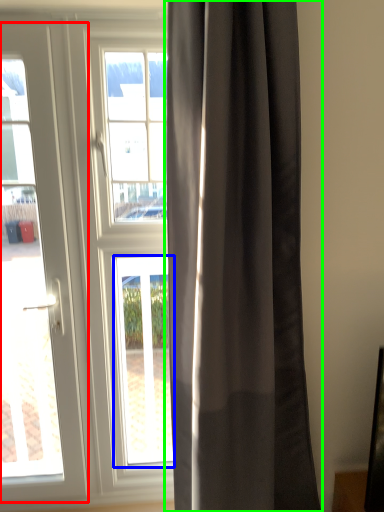
Question: Which object is positioned farthest from door (highlighted by a red box)? Select from window (highlighted by a blue box) and curtain (highlighted by a green box).

Choices:
 (A) window
 (B) curtain

Answer: (B)